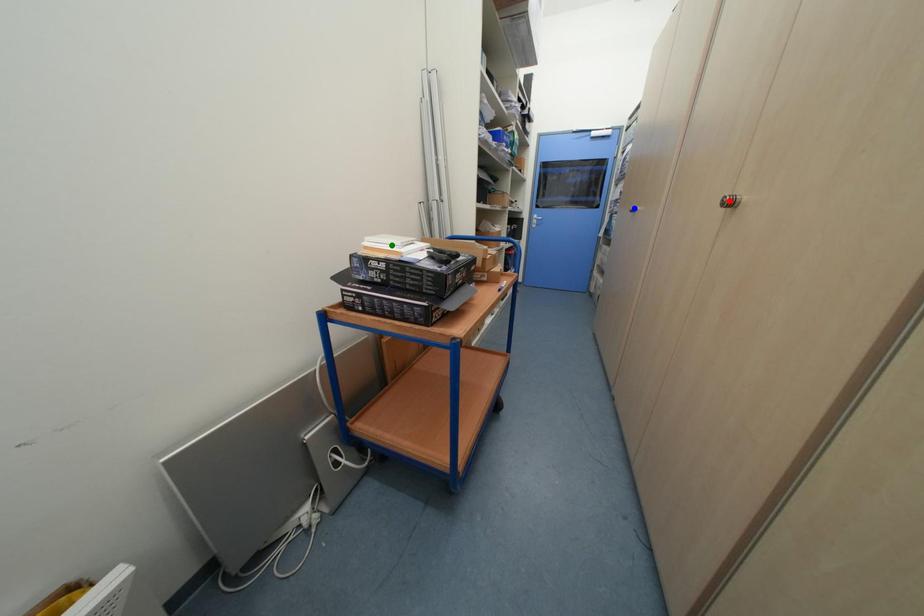
Order these from nearest to farthest:
green point, red point, blue point

red point → green point → blue point